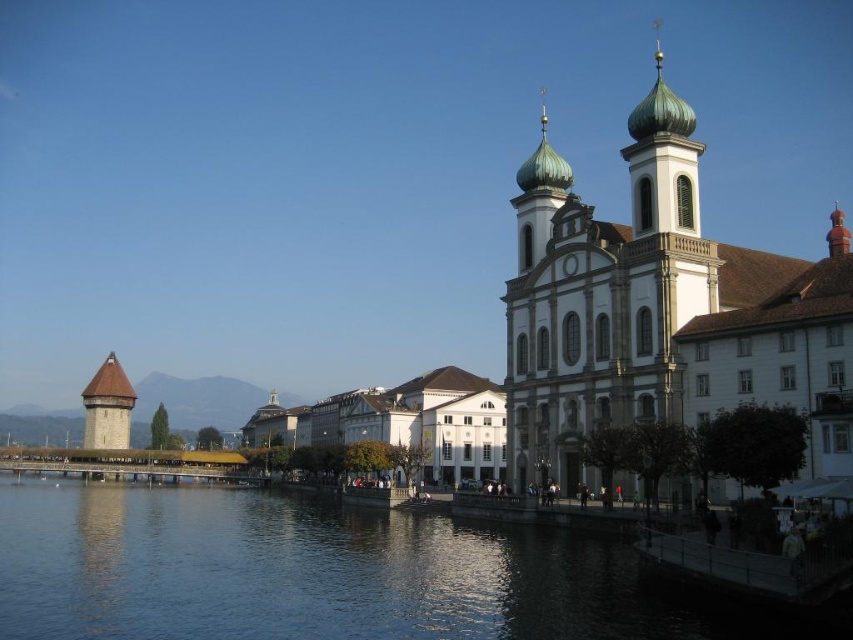
You are a tourist standing at the riverside and want to take a photo that includes both the green copper dome church at right and the brown wood tower at left. Based on their positions, which one should you position closer to the top of your camera frame?

The green copper dome church at right should be positioned closer to the top of your camera frame because it is above the brown wood tower at left.

You are a tourist standing at the riverside and want to take a photo that includes both the blue water at lower center and the brown wood tower at left. Based on their heights, which object should be placed lower in the photo frame to maintain proper perspective?

The blue water at lower center has a lesser height compared to the brown wood tower at left, so it should be placed lower in the photo frame to maintain proper perspective.